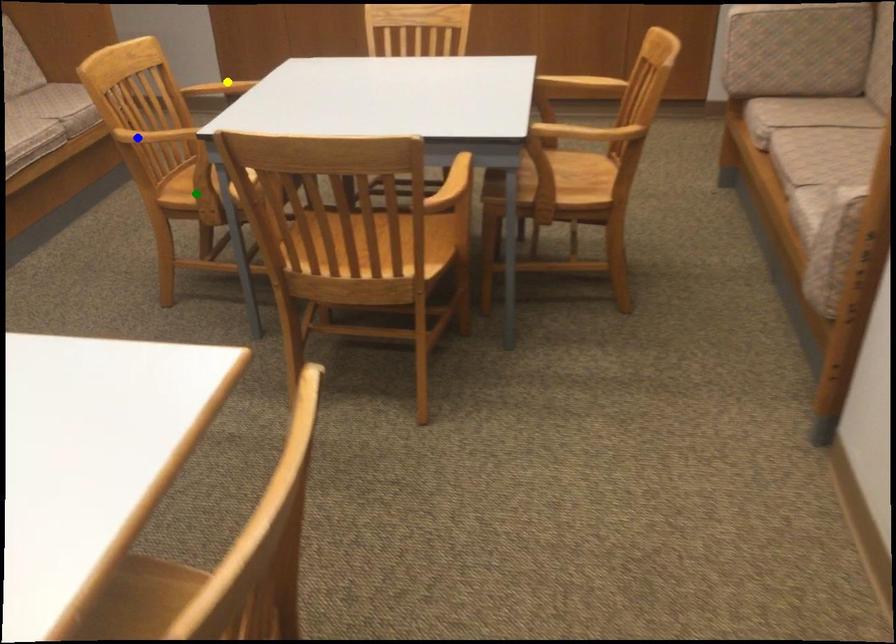
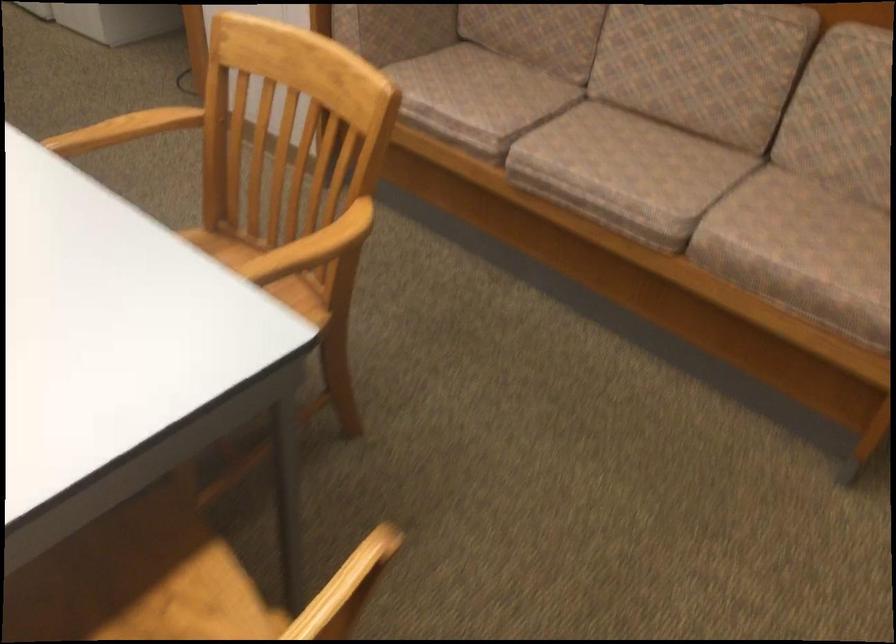
I am providing you with two images of the same scene from different viewpoints. Three points are marked in image1. Which point corresponds to a part or object that is occluded in image2?In image1, three points are marked. Which of them correspond to a part or object that is occluded in image2?Among the three points shown in image1, which one corresponds to a part or object that is no longer visible due to occlusion in image2?

green point